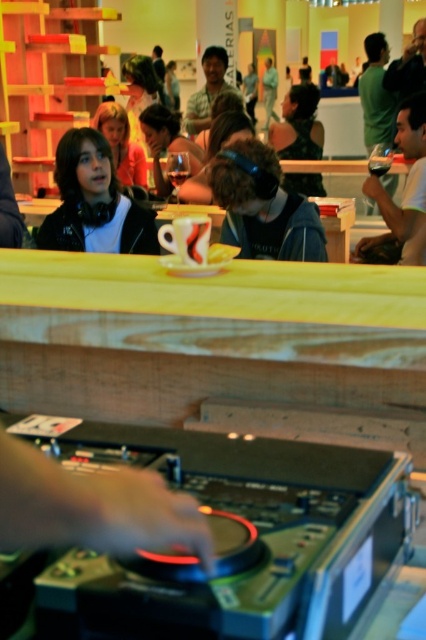
Question: Which object is the farthest from the dark blue headphones at center?

Choices:
 (A) matte black headphones at upper right
 (B) black fabric dress at upper center
 (C) matte black headphones at upper left

Answer: (B)

Question: Does matte black headphones at upper left have a lesser width compared to matte black headphones at upper right?

Choices:
 (A) yes
 (B) no

Answer: (B)

Question: Among these points, which one is nearest to the camera?

Choices:
 (A) (287, 134)
 (B) (232, 236)
 (C) (77, 140)

Answer: (B)

Question: Is matte black headphones at upper right below black fabric dress at upper center?

Choices:
 (A) yes
 (B) no

Answer: (A)

Question: Which of the following is the farthest from the observer?

Choices:
 (A) (52, 230)
 (B) (302, 198)
 (C) (397, 128)
 (D) (273, 134)

Answer: (D)

Question: Where is dark blue headphones at center located in relation to black fabric dress at upper center in the image?

Choices:
 (A) above
 (B) below

Answer: (B)